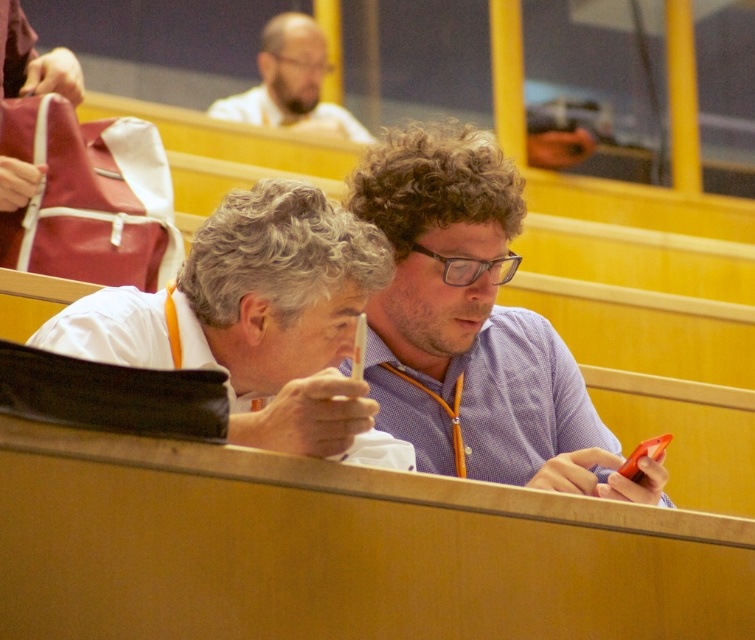
You are standing in the lecture hall and want to hand a note to the person wearing the purple checkered shirt at center. Considering the distance between you and them, can you comfortably walk over to deliver the note without needing to shout across the room?

The purple checkered shirt at center and viewer are 8.40 meters apart. Since 8.40 meters is a moderate distance, you can comfortably walk over to deliver the note without needing to shout across the room.